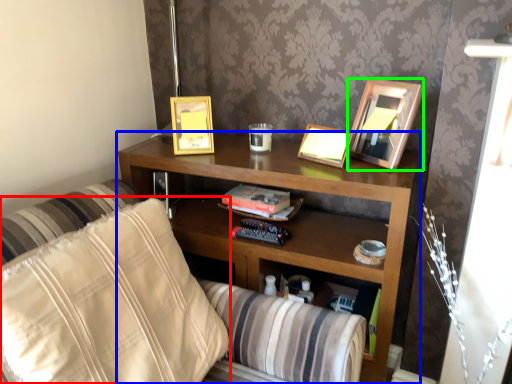
Question: Estimate the real-world distances between objects in this image. Which object is closer to pillow (highlighted by a red box), shelf (highlighted by a blue box) or picture frame (highlighted by a green box)?

Choices:
 (A) shelf
 (B) picture frame

Answer: (A)